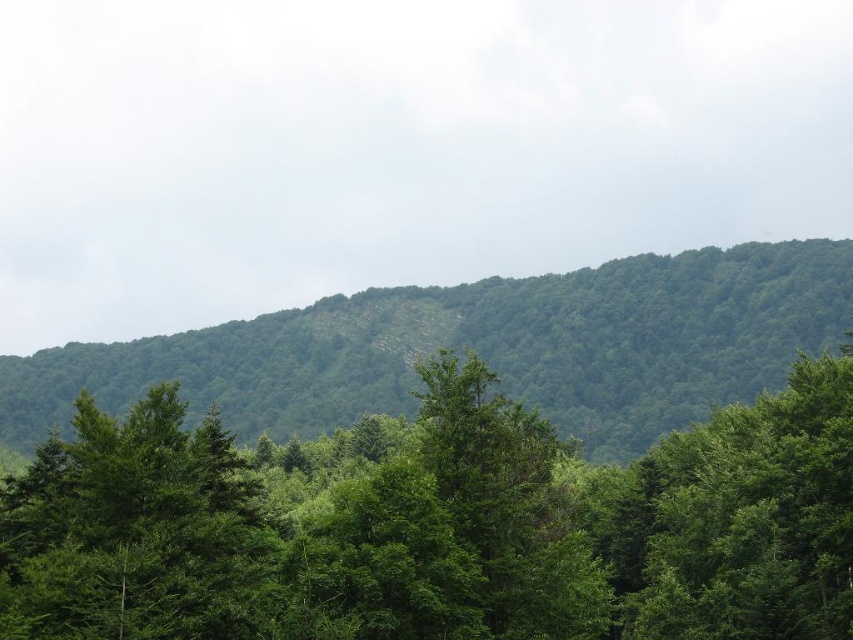
You are a hiker standing at the base of the green leafy tree at center and want to reach the green leafy forest at upper center. Which direction should you head towards to ascend?

You should head towards the upper center direction to ascend towards the green leafy forest at upper center since it is taller than the green leafy tree at center.

You are a hiker standing in the lush landscape. You notice a green leafy tree at center and a green leafy forest at upper center. Which one is positioned lower in the scene?

The green leafy tree at center is positioned lower than the green leafy forest at upper center.